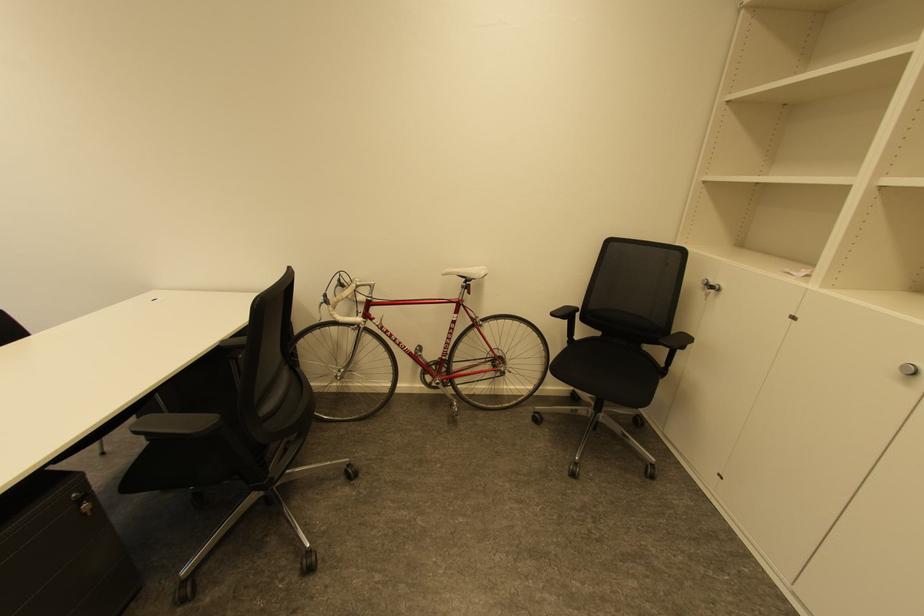
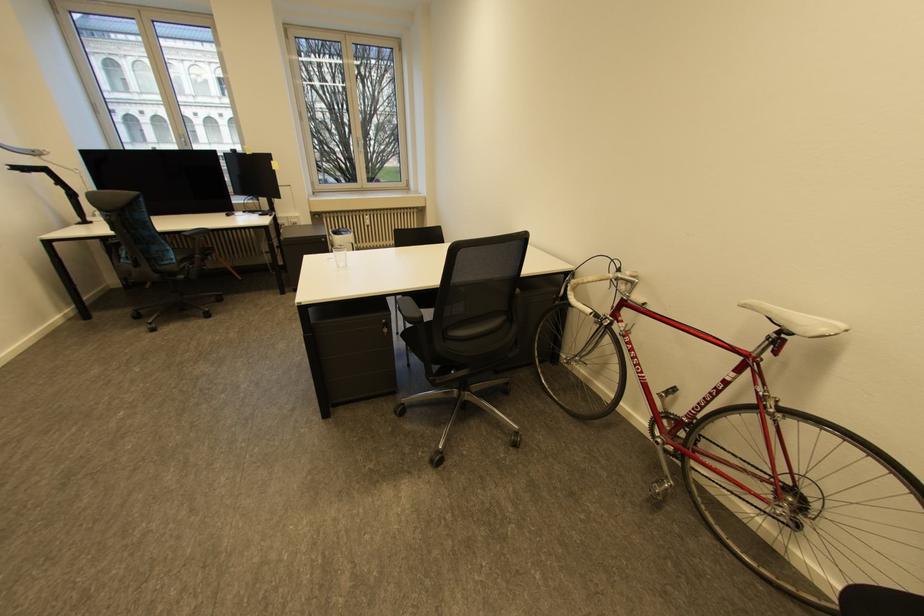
Question: The first image is from the beginning of the video and the second image is from the end. How did the camera likely rotate when shooting the video?

Choices:
 (A) Left
 (B) Right
 (C) Up
 (D) Down

Answer: (A)